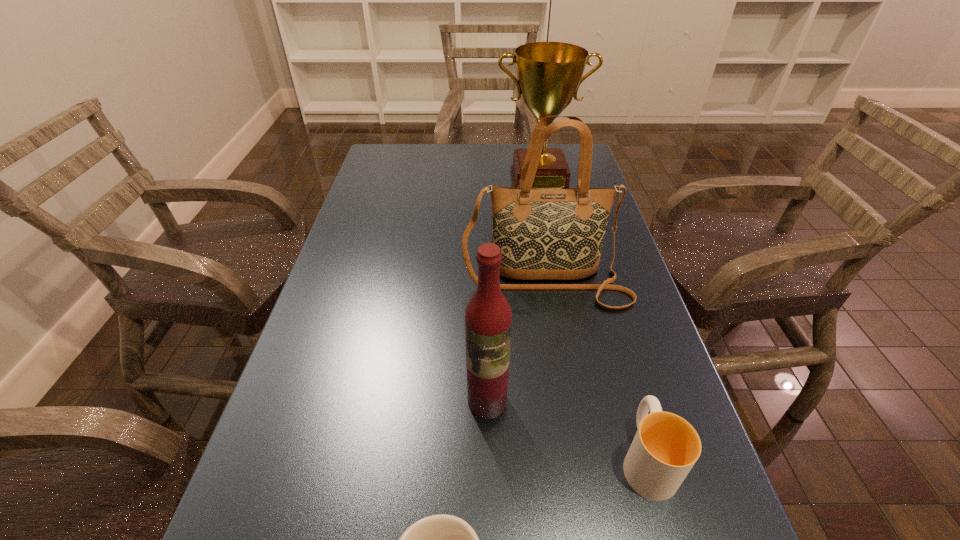
Find the location of `empty location between the third nearest object and the farthest object`. empty location between the third nearest object and the farthest object is located at coordinates (513, 291).

In order to click on object that stands as the third closest to the handbag in this screenshot , I will do `click(549, 74)`.

Point out which object is positioned as the second nearest to the third nearest object. Please provide its 2D coordinates. Your answer should be formatted as a tuple, i.e. [(x, y)], where the tuple contains the x and y coordinates of a point satisfying the conditions above.

[(543, 233)]